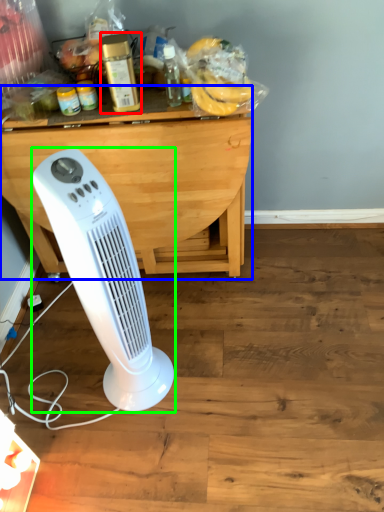
Question: Considering the real-world distances, which object is closest to bottle (highlighted by a red box)? table (highlighted by a blue box) or home appliance (highlighted by a green box).

Choices:
 (A) table
 (B) home appliance

Answer: (A)